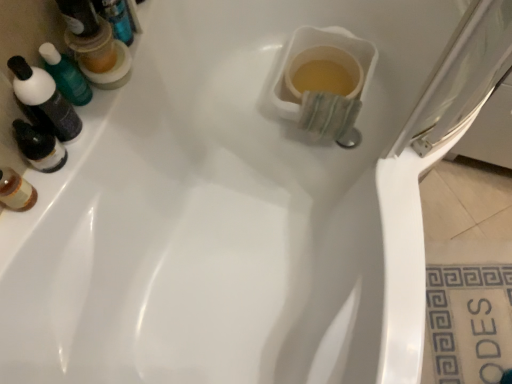
Question: Considering the relative sizes of translucent plastic mouthwash at upper left, the second mouthwash from the top, and translucent plastic mouthwash at upper left, which is counted as the 1th mouthwash, starting from the top, in the image provided, is translucent plastic mouthwash at upper left, the second mouthwash from the top, bigger than translucent plastic mouthwash at upper left, which is counted as the 1th mouthwash, starting from the top,?

Choices:
 (A) no
 (B) yes

Answer: (A)

Question: From the image's perspective, is translucent plastic mouthwash at upper left, which appears as the first mouthwash when ordered from the bottom, located beneath translucent plastic mouthwash at upper left, which is counted as the 1th mouthwash, starting from the top?

Choices:
 (A) no
 (B) yes

Answer: (B)

Question: From a real-world perspective, is translucent plastic mouthwash at upper left, the second mouthwash from the top, over translucent plastic mouthwash at upper left, which is counted as the 1th mouthwash, starting from the top?

Choices:
 (A) no
 (B) yes

Answer: (B)

Question: Is translucent plastic mouthwash at upper left, which appears as the first mouthwash when ordered from the bottom, far away from translucent plastic mouthwash at upper left, which appears as the 2th mouthwash when ordered from the bottom?

Choices:
 (A) no
 (B) yes

Answer: (A)

Question: Does translucent plastic mouthwash at upper left, which appears as the first mouthwash when ordered from the bottom, lie behind translucent plastic mouthwash at upper left, which is counted as the 1th mouthwash, starting from the top?

Choices:
 (A) yes
 (B) no

Answer: (B)

Question: Considering the relative sizes of translucent plastic mouthwash at upper left, which appears as the first mouthwash when ordered from the bottom, and translucent plastic mouthwash at upper left, which is counted as the 1th mouthwash, starting from the top, in the image provided, is translucent plastic mouthwash at upper left, which appears as the first mouthwash when ordered from the bottom, smaller than translucent plastic mouthwash at upper left, which is counted as the 1th mouthwash, starting from the top,?

Choices:
 (A) yes
 (B) no

Answer: (A)

Question: Considering the relative sizes of white ceramic tile at lower right and translucent plastic mouthwash at upper left, which appears as the 2th mouthwash when ordered from the bottom, in the image provided, is white ceramic tile at lower right bigger than translucent plastic mouthwash at upper left, which appears as the 2th mouthwash when ordered from the bottom,?

Choices:
 (A) yes
 (B) no

Answer: (A)

Question: Can we say white ceramic tile at lower right lies outside translucent plastic mouthwash at upper left, which appears as the 2th mouthwash when ordered from the bottom?

Choices:
 (A) yes
 (B) no

Answer: (A)

Question: Does white ceramic tile at lower right have a lesser height compared to translucent plastic mouthwash at upper left, which appears as the 2th mouthwash when ordered from the bottom?

Choices:
 (A) yes
 (B) no

Answer: (A)

Question: Is the surface of white ceramic tile at lower right in direct contact with translucent plastic mouthwash at upper left, which appears as the 2th mouthwash when ordered from the bottom?

Choices:
 (A) no
 (B) yes

Answer: (A)

Question: From a real-world perspective, is white ceramic tile at lower right physically above translucent plastic mouthwash at upper left, which appears as the 2th mouthwash when ordered from the bottom?

Choices:
 (A) yes
 (B) no

Answer: (B)

Question: Considering the relative sizes of white ceramic tile at lower right and translucent plastic mouthwash at upper left, which appears as the 2th mouthwash when ordered from the bottom, in the image provided, is white ceramic tile at lower right thinner than translucent plastic mouthwash at upper left, which appears as the 2th mouthwash when ordered from the bottom,?

Choices:
 (A) no
 (B) yes

Answer: (A)

Question: Considering the relative positions of transparent plastic screen door at upper right and translucent plastic mouthwash at upper left, which appears as the first mouthwash when ordered from the bottom, in the image provided, is transparent plastic screen door at upper right to the right of translucent plastic mouthwash at upper left, which appears as the first mouthwash when ordered from the bottom, from the viewer's perspective?

Choices:
 (A) no
 (B) yes

Answer: (B)